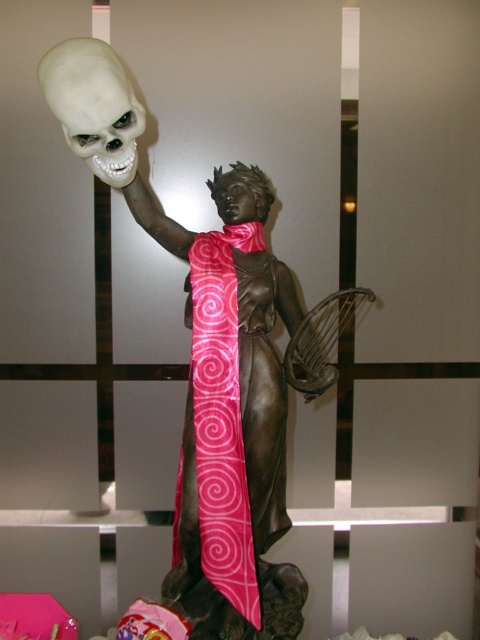
Who is positioned more to the left, bronze statue at center or pink silk tie at center?

From the viewer's perspective, pink silk tie at center appears more on the left side.

What do you see at coordinates (210, 364) in the screenshot?
I see `bronze statue at center` at bounding box center [210, 364].

You are a GUI agent. You are given a task and a screenshot of the screen. Output one action in this format:
    pyautogui.click(x=<x>, y=<y>)
    Task: Click on the bronze statue at center
    Image resolution: width=480 pixels, height=640 pixels.
    Given the screenshot: What is the action you would take?
    pyautogui.click(x=210, y=364)

Is bronze statue at center above white matte skull at upper left?

Actually, bronze statue at center is below white matte skull at upper left.

Consider the image. Is bronze statue at center thinner than white matte skull at upper left?

No.

You are a GUI agent. You are given a task and a screenshot of the screen. Output one action in this format:
    pyautogui.click(x=<x>, y=<y>)
    Task: Click on the bronze statue at center
    
    Given the screenshot: What is the action you would take?
    pyautogui.click(x=210, y=364)

Does pink silk tie at center have a larger size compared to white matte skull at upper left?

Correct, pink silk tie at center is larger in size than white matte skull at upper left.

Who is lower down, pink silk tie at center or white matte skull at upper left?

pink silk tie at center

Is point (193, 368) more distant than point (117, 83)?

That is True.

Locate an element on the screen. The height and width of the screenshot is (640, 480). pink silk tie at center is located at coordinates (222, 417).